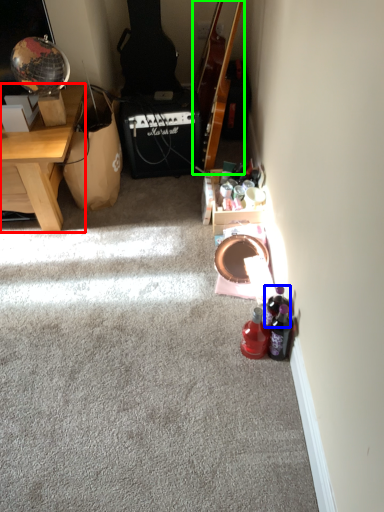
Question: Which object is the farthest from desk (highlighted by a red box)? Choose among these: bottle (highlighted by a blue box) or guitar (highlighted by a green box).

Choices:
 (A) bottle
 (B) guitar

Answer: (A)